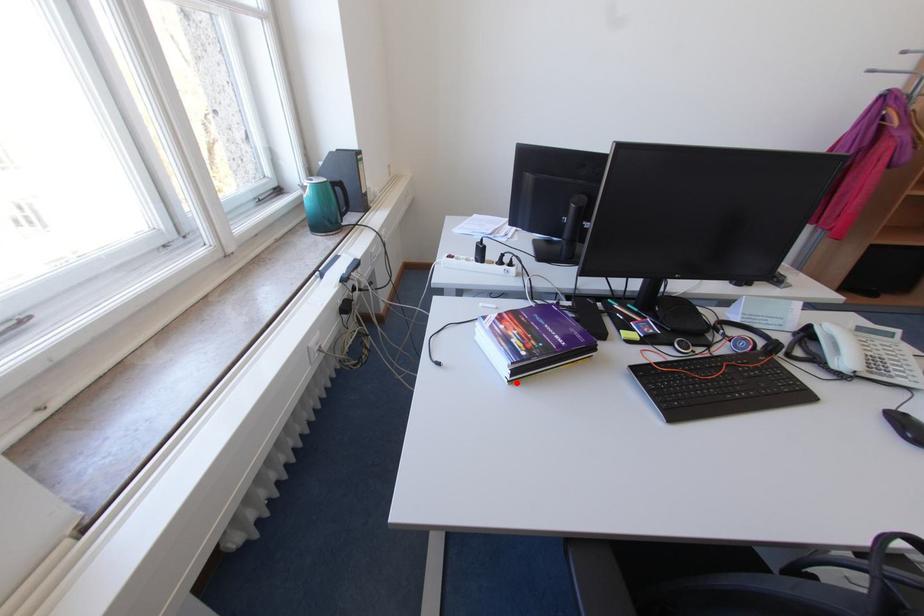
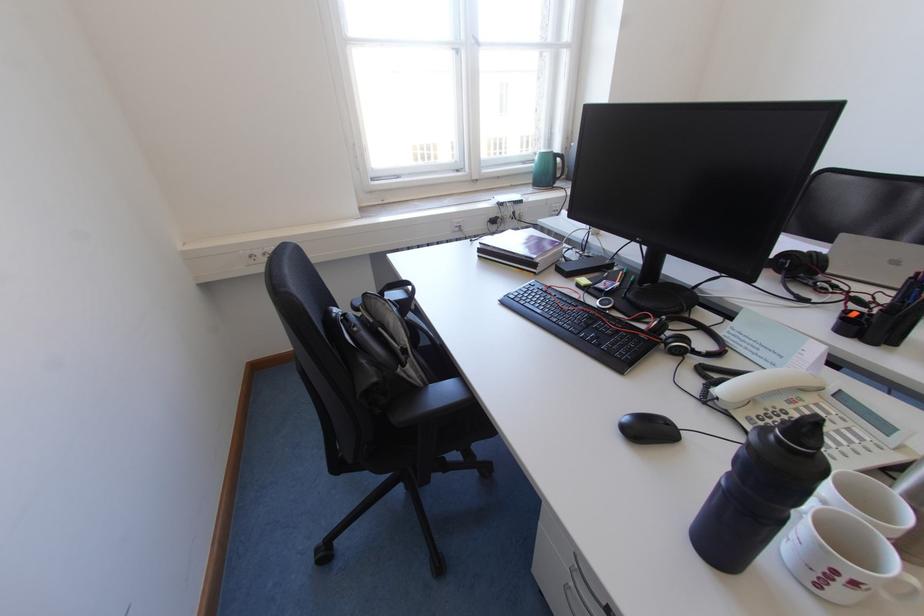
The point at the highlighted location is marked in the first image. Where is the corresponding point in the second image?

(487, 257)